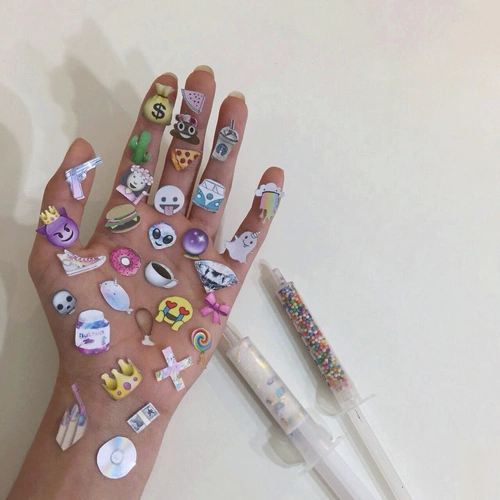
The height and width of the screenshot is (500, 500). Find the location of `stickers`. stickers is located at coordinates (163, 280), (89, 258), (93, 340), (223, 148).